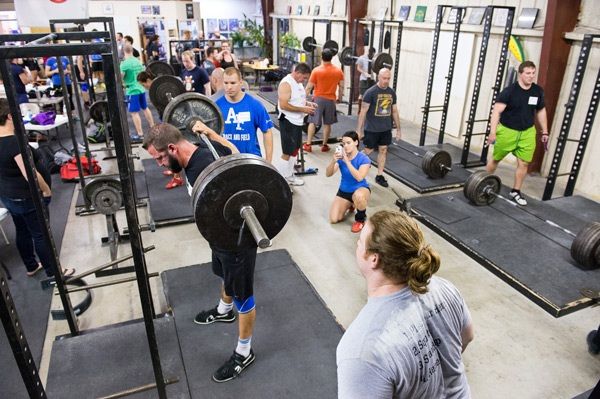
You are a GUI agent. You are given a task and a screenshot of the screen. Output one action in this format:
    pyautogui.click(x=<x>, y=<y>)
    Task: Click on the plates
    This screenshot has width=600, height=399.
    Given the screenshot: What is the action you would take?
    tap(583, 248), tap(486, 185), tap(435, 161), tap(268, 203), tap(186, 101), tap(160, 80), tap(162, 61), tap(117, 194), tap(103, 107)